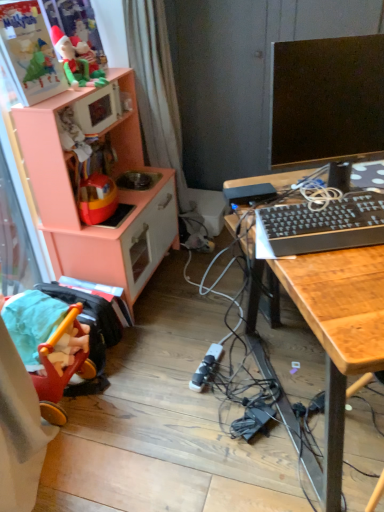
Find the location of a particular element. black glossy monitor at upper right is located at coordinates (327, 101).

Find the location of a particular element. black plastic keyboard at right is located at coordinates (320, 226).

What is the approximate height of black plastic keyboard at right?

The height of black plastic keyboard at right is 3.54 inches.

What is the approximate width of red plastic swivel chair at lower left?

red plastic swivel chair at lower left is 12.17 inches in width.

Find the location of `matte green plush toy at upper left`. matte green plush toy at upper left is located at coordinates [x=77, y=60].

This screenshot has width=384, height=512. In order to click on wooden desk at right in this screenshot , I will do `click(340, 331)`.

The image size is (384, 512). What do you see at coordinates (156, 88) in the screenshot?
I see `white fabric curtain at center` at bounding box center [156, 88].

At what (x,y) coordinates should I click in order to perform the action: click on black glossy monitor at upper right. Please return your answer as a coordinate pair (x, y). The width and height of the screenshot is (384, 512). Looking at the image, I should click on (327, 101).

Considering the positions of objects black plastic plug at center and matte green plush toy at upper left in the image provided, who is more to the left, black plastic plug at center or matte green plush toy at upper left?

→ Positioned to the left is matte green plush toy at upper left.

Is black plastic plug at center in contact with matte green plush toy at upper left?

They are not placed beside each other.

Considering the relative sizes of black plastic plug at center and matte green plush toy at upper left in the image provided, is black plastic plug at center shorter than matte green plush toy at upper left?

Indeed, black plastic plug at center has a lesser height compared to matte green plush toy at upper left.

Which is behind, black plastic plug at center or matte green plush toy at upper left?

Positioned behind is matte green plush toy at upper left.

Considering the sizes of objects matte green plush toy at upper left and black plastic plug at center in the image provided, who is thinner, matte green plush toy at upper left or black plastic plug at center?

Thinner between the two is matte green plush toy at upper left.

From the image's perspective, which object appears higher, matte green plush toy at upper left or black plastic plug at center?

From the image's view, matte green plush toy at upper left is above.

Considering the relative positions of matte green plush toy at upper left and black plastic plug at center in the image provided, is matte green plush toy at upper left to the left of black plastic plug at center from the viewer's perspective?

Correct, you'll find matte green plush toy at upper left to the left of black plastic plug at center.

Is matte green plush toy at upper left further to the viewer compared to black plastic plug at center?

Yes, it is behind black plastic plug at center.

Which is more distant, (200, 366) or (325, 277)?

The point (200, 366) is farther.

Considering the sizes of objects black plastic plug at center and wooden desk at right in the image provided, who is shorter, black plastic plug at center or wooden desk at right?

black plastic plug at center is shorter.

Between black plastic plug at center and wooden desk at right, which one is positioned in front?

wooden desk at right is in front.

Considering the sizes of objects black plastic plug at center and wooden desk at right in the image provided, who is bigger, black plastic plug at center or wooden desk at right?

wooden desk at right is bigger.

Between red plastic swivel chair at lower left and black glossy monitor at upper right, which one has more height?

black glossy monitor at upper right is taller.

Can you confirm if red plastic swivel chair at lower left is positioned to the right of black glossy monitor at upper right?

No, red plastic swivel chair at lower left is not to the right of black glossy monitor at upper right.

From the image's perspective, which object appears higher, red plastic swivel chair at lower left or black glossy monitor at upper right?

From the image's view, black glossy monitor at upper right is above.

Measure the distance between red plastic swivel chair at lower left and black glossy monitor at upper right.

They are 1.02 meters apart.

Can black plastic plug at center be found inside peach wood toy kitchen at left?

No, black plastic plug at center is not a part of peach wood toy kitchen at left.

Is peach wood toy kitchen at left facing towards black plastic plug at center?

Yes, peach wood toy kitchen at left is oriented towards black plastic plug at center.

Does peach wood toy kitchen at left appear on the left side of black plastic plug at center?

Correct, you'll find peach wood toy kitchen at left to the left of black plastic plug at center.

Considering their positions, is matte green plush toy at upper left located in front of or behind black plastic keyboard at right?

In the image, matte green plush toy at upper left appears behind black plastic keyboard at right.

Does matte green plush toy at upper left turn towards black plastic keyboard at right?

No, matte green plush toy at upper left is not turned towards black plastic keyboard at right.

Which is nearer, (83, 48) or (283, 245)?

Positioned in front is point (283, 245).

Where is `toy lying above the black plastic keyboard at right (from the image's perspective)`? The width and height of the screenshot is (384, 512). toy lying above the black plastic keyboard at right (from the image's perspective) is located at coordinates (77, 60).

Is black glossy monitor at upper right placed right next to red plastic swivel chair at lower left?

They are not placed beside each other.

Considering the relative positions of black glossy monitor at upper right and red plastic swivel chair at lower left in the image provided, is black glossy monitor at upper right to the left of red plastic swivel chair at lower left from the viewer's perspective?

Incorrect, black glossy monitor at upper right is not on the left side of red plastic swivel chair at lower left.

Considering the sizes of black glossy monitor at upper right and red plastic swivel chair at lower left in the image, is black glossy monitor at upper right taller or shorter than red plastic swivel chair at lower left?

In the image, black glossy monitor at upper right appears to be taller than red plastic swivel chair at lower left.

Which is further, (361, 91) or (57, 335)?

The point (57, 335) is more distant.

The height and width of the screenshot is (512, 384). I want to click on toy lying above the black plastic plug at center (from the image's perspective), so pyautogui.click(x=77, y=60).

Where is `plug that appears in front of the matte green plush toy at upper left`? The height and width of the screenshot is (512, 384). plug that appears in front of the matte green plush toy at upper left is located at coordinates coord(206,368).

Based on their spatial positions, is white fabric curtain at center or wooden desk at right closer to matte green plush toy at upper left?

Among the two, white fabric curtain at center is located nearer to matte green plush toy at upper left.

When comparing their distances from black plastic plug at center, does matte green plush toy at upper left or peach wood toy kitchen at left seem closer?

peach wood toy kitchen at left lies closer to black plastic plug at center than the other object.

Based on the photo, considering their positions, is white fabric curtain at center positioned further to matte green plush toy at upper left than red plastic swivel chair at lower left?

Among the two, red plastic swivel chair at lower left is located further to matte green plush toy at upper left.

When comparing their distances from matte green plush toy at upper left, does wooden desk at right or black plastic keyboard at right seem closer?

black plastic keyboard at right is closer to matte green plush toy at upper left.

Based on their spatial positions, is white fabric curtain at center or black plastic keyboard at right further from black glossy monitor at upper right?

The object further to black glossy monitor at upper right is white fabric curtain at center.

Considering their positions, is white fabric curtain at center positioned closer to peach wood toy kitchen at left than black plastic plug at center?

Based on the image, white fabric curtain at center appears to be nearer to peach wood toy kitchen at left.

When comparing their distances from black plastic plug at center, does black glossy monitor at upper right or wooden desk at right seem closer?

wooden desk at right.

Considering their positions, is wooden desk at right positioned further to white fabric curtain at center than black plastic keyboard at right?

wooden desk at right.

At what (x,y) coordinates should I click in order to perform the action: click on computer keyboard between black glossy monitor at upper right and wooden desk at right in the up-down direction. Please return your answer as a coordinate pair (x, y). The width and height of the screenshot is (384, 512). Looking at the image, I should click on (320, 226).

Image resolution: width=384 pixels, height=512 pixels. I want to click on desk between white fabric curtain at center and black plastic plug at center in the up-down direction, so click(x=340, y=331).

Where is `swivel chair between matte green plush toy at upper left and black plastic plug at center from top to bottom`? swivel chair between matte green plush toy at upper left and black plastic plug at center from top to bottom is located at coordinates (61, 366).

This screenshot has width=384, height=512. What are the coordinates of `computer keyboard between matte green plush toy at upper left and red plastic swivel chair at lower left in the up-down direction` in the screenshot? It's located at click(320, 226).